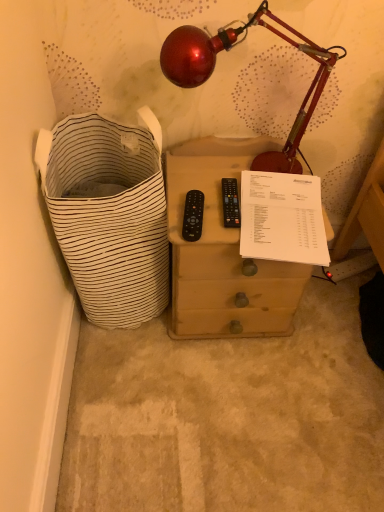
You are a GUI agent. You are given a task and a screenshot of the screen. Output one action in this format:
    pyautogui.click(x=<x>, y=<y>)
    Task: Click on the vacant area that is situated to the right of black plastic remote at center, the 2th control positioned from the right
    This screenshot has width=384, height=512.
    Given the screenshot: What is the action you would take?
    pyautogui.click(x=251, y=222)